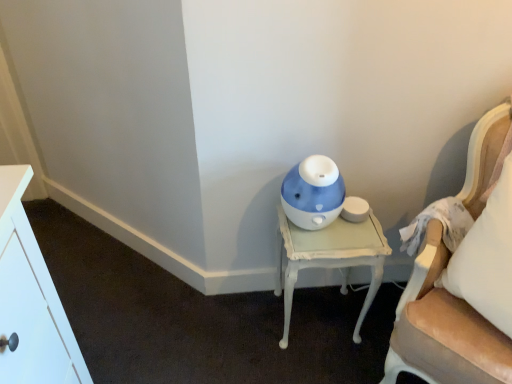
Locate an element on the screen. The height and width of the screenshot is (384, 512). empty space that is to the right of white painted wood nightstand at lower right is located at coordinates (373, 322).